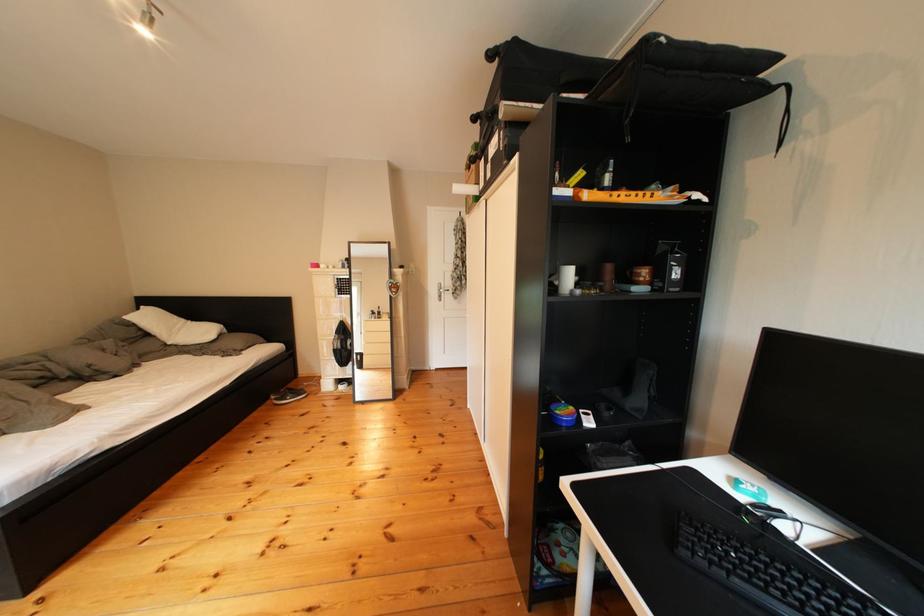
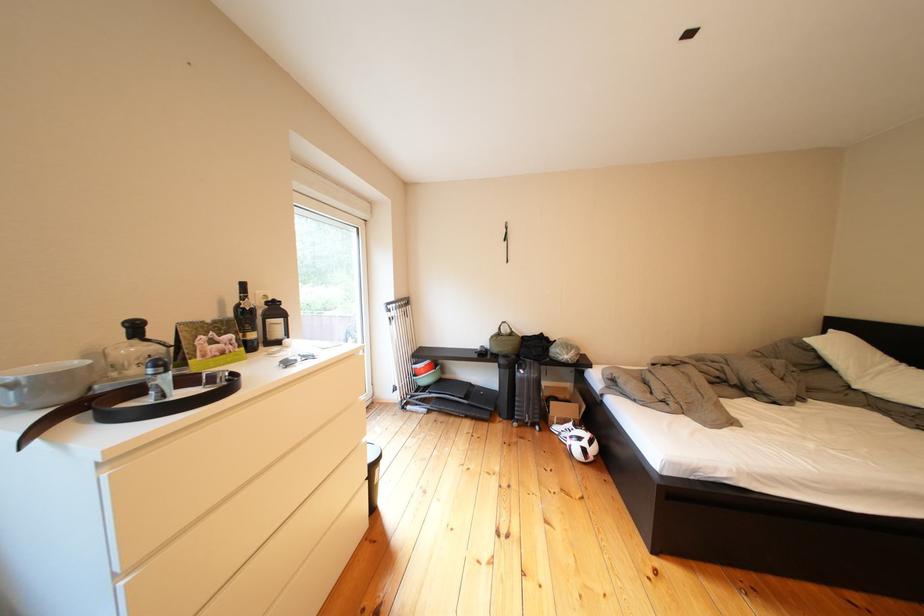
Question: The images are taken continuously from a first-person perspective. In which direction is your viewpoint rotating?

Choices:
 (A) Left
 (B) Right
 (C) Up
 (D) Down

Answer: (A)